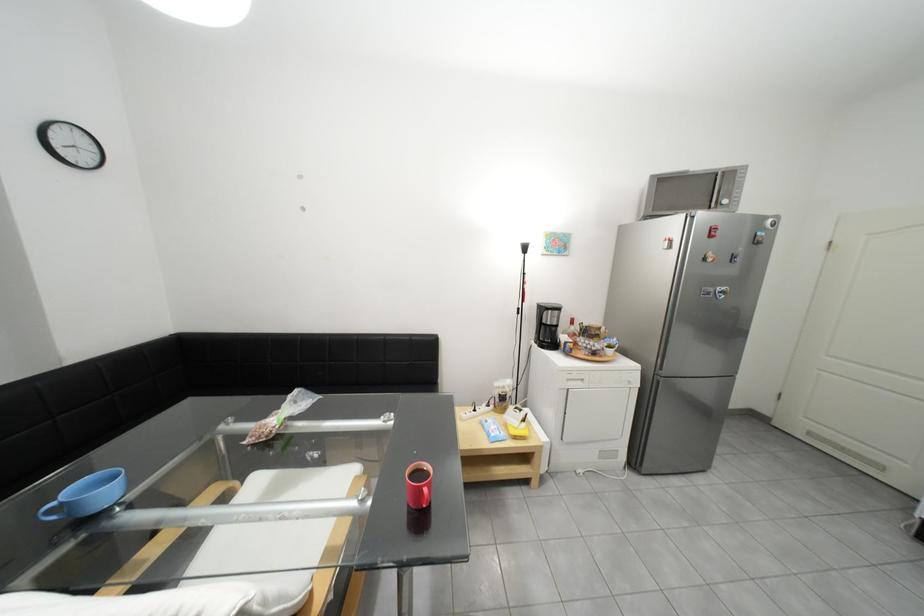
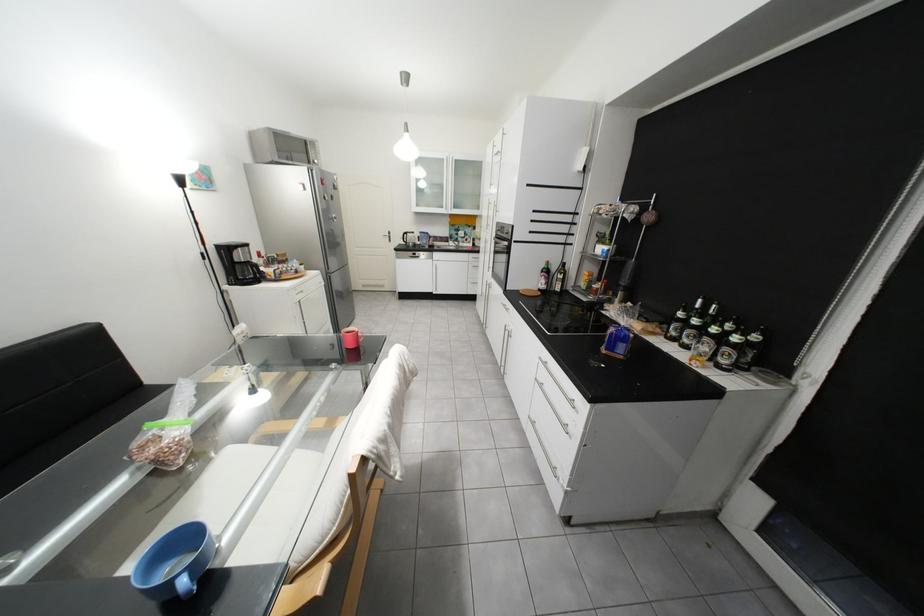
Locate, in the second image, the point that corresponds to the point at 555,323 in the first image.

(249, 262)